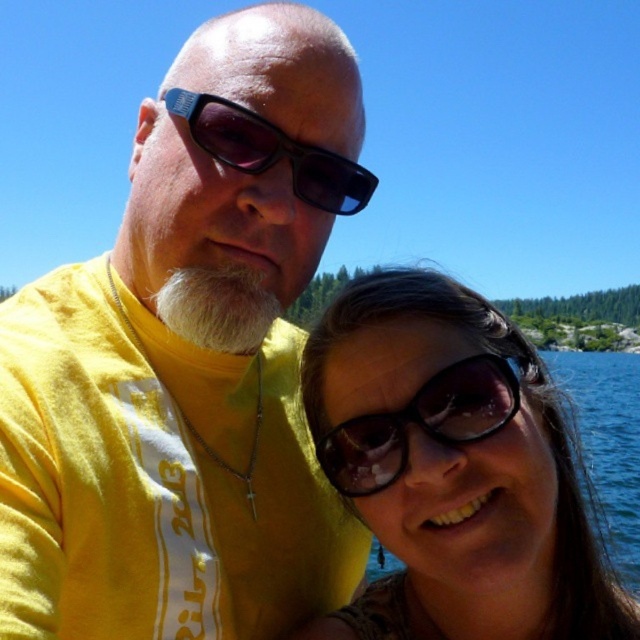
You are a photographer trying to capture a closeup of the two people in the scene. You notice both the matte black sunglasses at center and the matte black sunglasses at upper center. Which pair of sunglasses is positioned higher up in the image?

The matte black sunglasses at upper center is positioned higher up in the image than the matte black sunglasses at center.

You are a photographer adjusting the focus on your camera. You need to ensure that both the matte black sunglasses at center and the person on the right are in sharp focus. Given their positions, can you confirm if adjusting the focus to the sunglasses will also keep the woman on the right in focus?

The matte black sunglasses at center is located at point [452,470], so adjusting the focus to the sunglasses will also keep the woman on the right in focus as they are at the same focal plane.